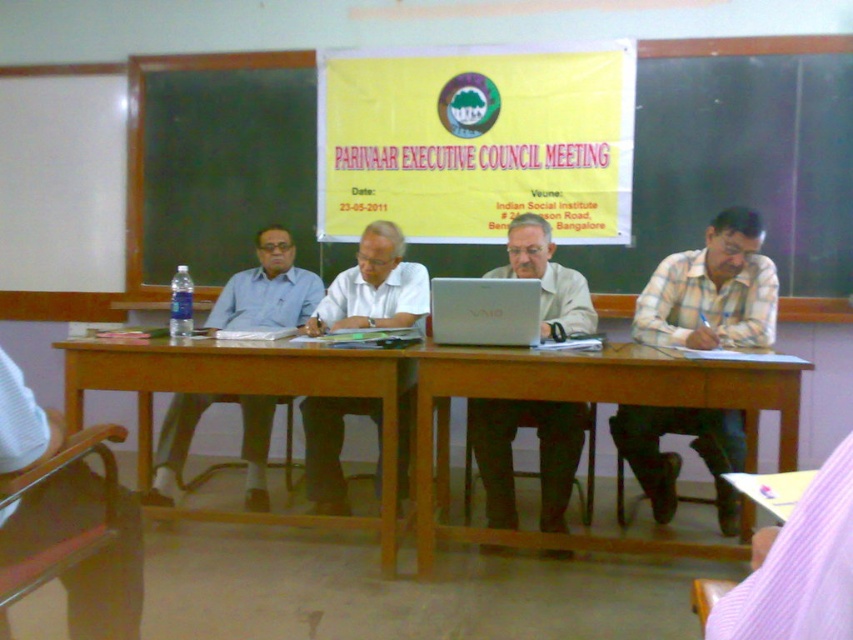
You are organizing a presentation and need to decide where to place a large projector screen. Considering the space occupied by the purple striped shirt at lower right and the silver metallic laptop at center, which object takes up more horizontal space in the image?

The silver metallic laptop at center has a greater width than the purple striped shirt at lower right, so the laptop occupies more horizontal space.

You are attending the Parivaar Executive Council Meeting and want to hand a document to both the person in the plaid cotton shirt at right and the person in the purple striped shirt at lower right. Which person should you approach first based on their seating position?

You should approach the person in the plaid cotton shirt at right first because they are closer to you than the purple striped shirt at lower right, who is seated further away.

You are organizing a small workshop and need to place a 1.2 meter long presentation board on the table. Given the wooden table at center and the silver metallic laptop at center, which object can accommodate the board without overlapping the laptop?

The wooden table at center is larger in size than the silver metallic laptop at center, so the presentation board can be placed on the wooden table at center without overlapping the laptop.